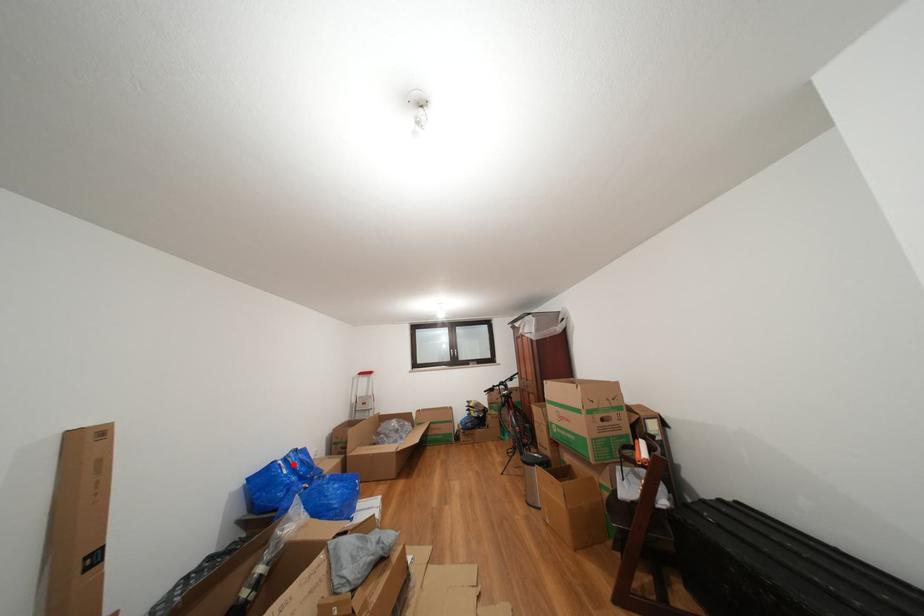
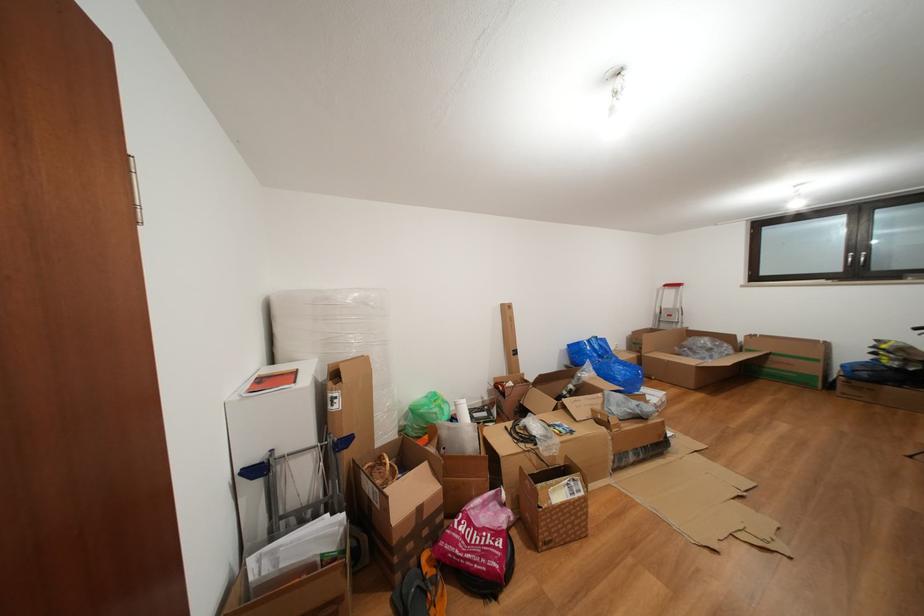
Question: I am providing you with two images of the same scene from different viewpoints. In image1, a red point is highlighted. Considering the same 3D point in image2, which of the following is correct?

Choices:
 (A) It is closer
 (B) It is farther

Answer: (B)